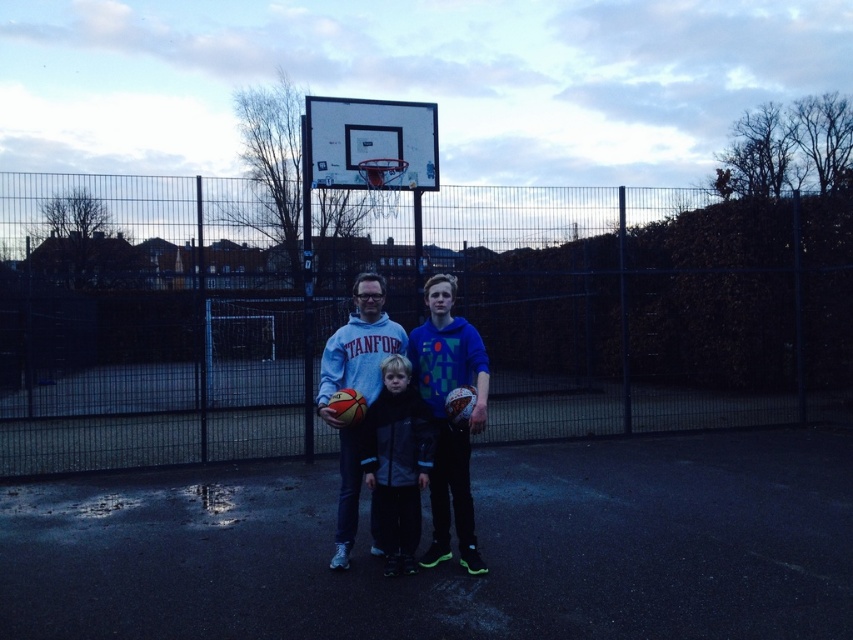
Question: Is blue matte hoodie at center bigger than matte gray hoodie at center?

Choices:
 (A) yes
 (B) no

Answer: (B)

Question: Which is farther from the blue matte hoodie at center?

Choices:
 (A) matte gray hoodie at center
 (B) matte blue hoodie at center

Answer: (A)

Question: Is blue matte hoodie at center above matte gray hoodie at center?

Choices:
 (A) no
 (B) yes

Answer: (A)

Question: Considering the relative positions of blue matte hoodie at center and matte blue hoodie at center in the image provided, where is blue matte hoodie at center located with respect to matte blue hoodie at center?

Choices:
 (A) above
 (B) below

Answer: (B)

Question: Which point is closer to the camera?

Choices:
 (A) blue matte hoodie at center
 (B) matte gray hoodie at center

Answer: (B)

Question: Based on their relative distances, which object is nearer to the dark gray fleece jacket at center?

Choices:
 (A) matte gray hoodie at center
 (B) blue matte hoodie at center
 (C) matte blue hoodie at center

Answer: (A)